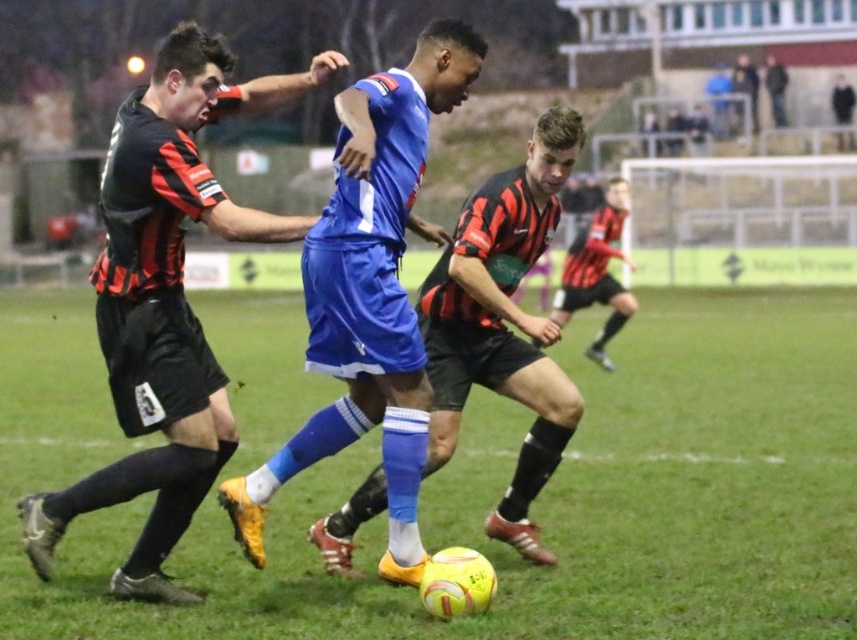
In the scene shown: You are a soccer referee observing the match. You notice the yellow matte soccer ball at center and the blue matte shorts at center. Which object has a greater width?

The yellow matte soccer ball at center has a greater width than the blue matte shorts at center according to the description.

You are a referee standing at the edge of the field. You need to determine if the black matte jersey at left is within the required 1.5 meters distance from the blue matte soccer ball at center to avoid a foul. Can they proceed without committing a foul?

The distance between the black matte jersey at left and the blue matte soccer ball at center is 1.35 meters, which is within the 1.5 meters requirement. Therefore, the player can proceed without committing a foul.